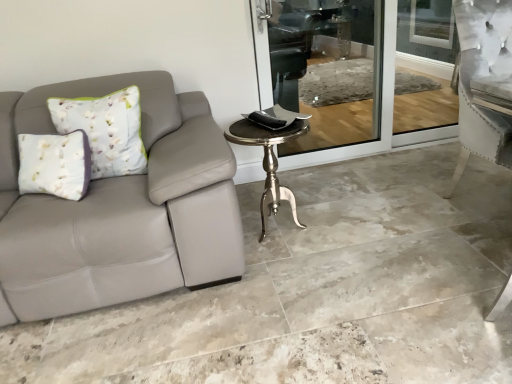
Question: Considering the relative positions of gray tile floor at lower left and polished brass table at center in the image provided, is gray tile floor at lower left to the left of polished brass table at center from the viewer's perspective?

Choices:
 (A) yes
 (B) no

Answer: (B)

Question: Is gray tile floor at lower left wider than polished brass table at center?

Choices:
 (A) yes
 (B) no

Answer: (A)

Question: Is gray tile floor at lower left bigger than polished brass table at center?

Choices:
 (A) no
 (B) yes

Answer: (B)

Question: Is gray tile floor at lower left facing towards polished brass table at center?

Choices:
 (A) no
 (B) yes

Answer: (A)

Question: From the image's perspective, is gray tile floor at lower left on polished brass table at center?

Choices:
 (A) yes
 (B) no

Answer: (A)

Question: Is gray tile floor at lower left thinner than polished brass table at center?

Choices:
 (A) no
 (B) yes

Answer: (A)

Question: From the image's perspective, would you say polished brass table at center is shown under gray tile floor at lower left?

Choices:
 (A) yes
 (B) no

Answer: (A)

Question: From a real-world perspective, does polished brass table at center stand above gray tile floor at lower left?

Choices:
 (A) no
 (B) yes

Answer: (B)

Question: Is polished brass table at center positioned with its back to gray tile floor at lower left?

Choices:
 (A) no
 (B) yes

Answer: (B)

Question: Does polished brass table at center come behind gray tile floor at lower left?

Choices:
 (A) yes
 (B) no

Answer: (A)

Question: Is polished brass table at center at the right side of gray tile floor at lower left?

Choices:
 (A) yes
 (B) no

Answer: (B)

Question: From a real-world perspective, does polished brass table at center sit lower than gray tile floor at lower left?

Choices:
 (A) no
 (B) yes

Answer: (A)

Question: In terms of height, does gray tile floor at lower left look taller or shorter compared to polished brass table at center?

Choices:
 (A) short
 (B) tall

Answer: (A)